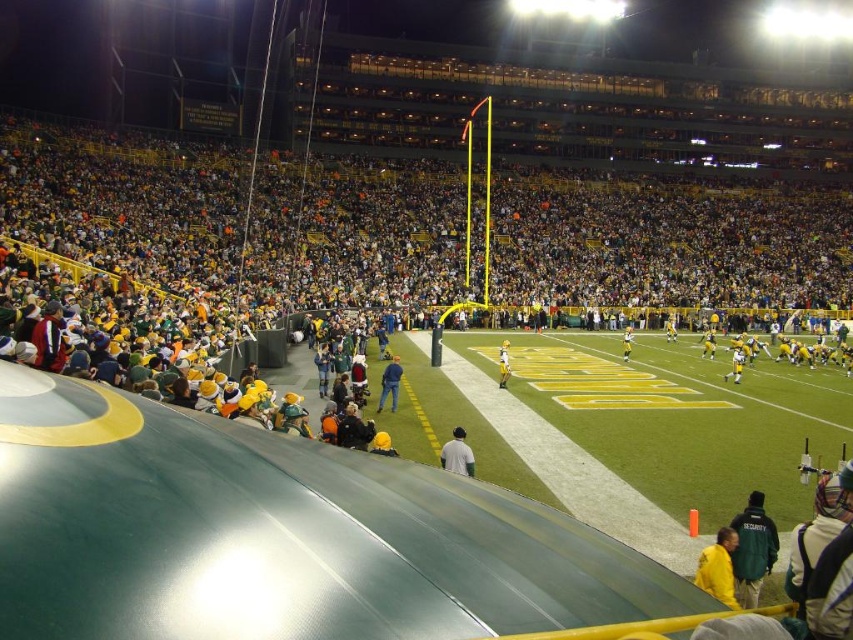
You are standing at the point marked as point (747, 600) in the stadium. The distance between you and the viewer is 11.79 meters. If you want to move closer to the viewer, which direction should you walk?

Since the distance between you and the viewer is 11.79 meters, you should walk towards the viewer to reduce the distance.

In the scene shown: You are a photographer standing at point A and want to take a photo of the crowd. There are two points marked in the image. The first point is at coordinates point A at (x=758, y=548), and the second point is at coordinates point B at (x=390, y=372). If you move towards point B, will point A still be visible in your line of sight?

Point A at (x=758, y=548) is in front of point B at (x=390, y=372). Moving towards point B would mean point A is closer to you, so it would still be visible in your line of sight as you move forward.

You are a photographer at the stadium and want to capture both the blue jeans at center and the yellow uniform at center in a single photo. Which object should you focus on first to ensure both are in frame?

The blue jeans at center is taller than the yellow uniform at center, so you should focus on the blue jeans at center first to ensure both are in frame.